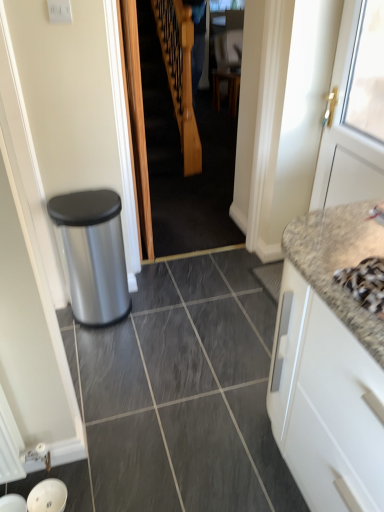
Question: Is wooden staircase at center positioned behind silver metallic faucet at upper right?

Choices:
 (A) no
 (B) yes

Answer: (B)

Question: Is wooden staircase at center not near silver metallic faucet at upper right?

Choices:
 (A) yes
 (B) no

Answer: (A)

Question: Does wooden staircase at center have a greater width compared to silver metallic faucet at upper right?

Choices:
 (A) yes
 (B) no

Answer: (B)

Question: From a real-world perspective, is wooden staircase at center positioned under silver metallic faucet at upper right based on gravity?

Choices:
 (A) yes
 (B) no

Answer: (A)

Question: Can you confirm if wooden staircase at center is bigger than silver metallic faucet at upper right?

Choices:
 (A) yes
 (B) no

Answer: (A)

Question: Is blue fabric at center spatially inside white painted wood door at right, or outside of it?

Choices:
 (A) outside
 (B) inside

Answer: (A)

Question: Based on their positions, is blue fabric at center located to the left or right of white painted wood door at right?

Choices:
 (A) right
 (B) left

Answer: (B)

Question: Is point (198, 33) positioned closer to the camera than point (337, 143)?

Choices:
 (A) closer
 (B) farther

Answer: (B)

Question: Considering the positions of blue fabric at center and white painted wood door at right in the image, is blue fabric at center bigger or smaller than white painted wood door at right?

Choices:
 (A) small
 (B) big

Answer: (A)

Question: From a real-world perspective, is white painted wood door at right physically located above or below silver metallic faucet at upper right?

Choices:
 (A) below
 (B) above

Answer: (A)

Question: Is point (357, 23) closer or farther from the camera than point (379, 220)?

Choices:
 (A) closer
 (B) farther

Answer: (B)

Question: Is white painted wood door at right in front of or behind silver metallic faucet at upper right in the image?

Choices:
 (A) front
 (B) behind

Answer: (B)

Question: Is white painted wood door at right taller or shorter than silver metallic faucet at upper right?

Choices:
 (A) tall
 (B) short

Answer: (A)

Question: From the image's perspective, is wooden staircase at center above or below white matte cabinet at right?

Choices:
 (A) below
 (B) above

Answer: (B)

Question: From a real-world perspective, is wooden staircase at center positioned above or below white matte cabinet at right?

Choices:
 (A) above
 (B) below

Answer: (A)